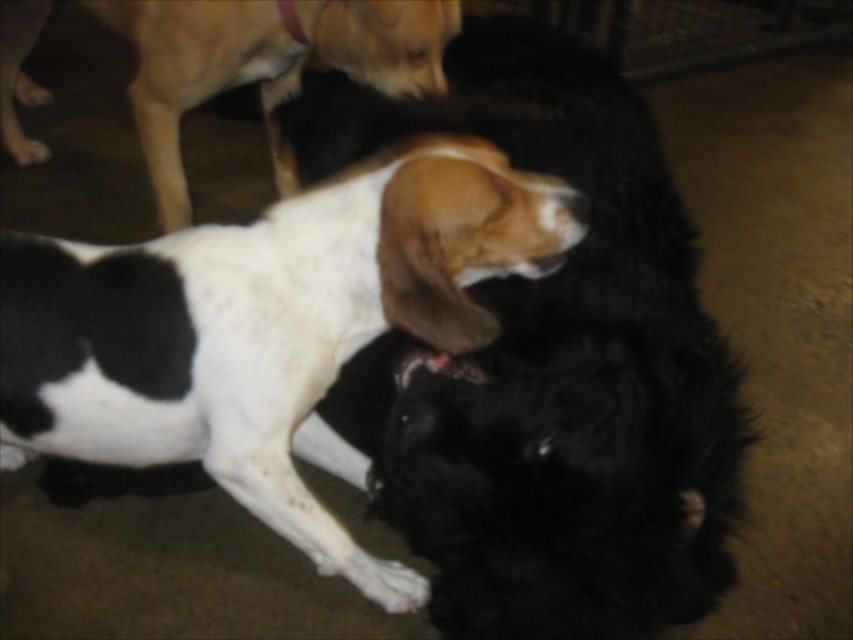
From the picture: Does white and black fur dog at center have a lesser height compared to white and brown fur dog at center?

No, white and black fur dog at center is not shorter than white and brown fur dog at center.

This screenshot has width=853, height=640. What do you see at coordinates (267, 328) in the screenshot? I see `white and black fur dog at center` at bounding box center [267, 328].

Identify the location of white and black fur dog at center. (267, 328).

Between black fluffy dog at center and white and brown fur dog at center, which one has less height?

With less height is white and brown fur dog at center.

Can you confirm if black fluffy dog at center is wider than white and brown fur dog at center?

No, black fluffy dog at center is not wider than white and brown fur dog at center.

This screenshot has width=853, height=640. I want to click on black fluffy dog at center, so click(x=549, y=365).

At what (x,y) coordinates should I click in order to perform the action: click on black fluffy dog at center. Please return your answer as a coordinate pair (x, y). The image size is (853, 640). Looking at the image, I should click on (549, 365).

In the scene shown: Who is more forward, (560, 97) or (56, 433)?

Point (56, 433) is in front.

Which is behind, point (380, 444) or point (325, 328)?

The point (380, 444) is behind.

Identify the location of black fluffy dog at center. This screenshot has height=640, width=853. (549, 365).